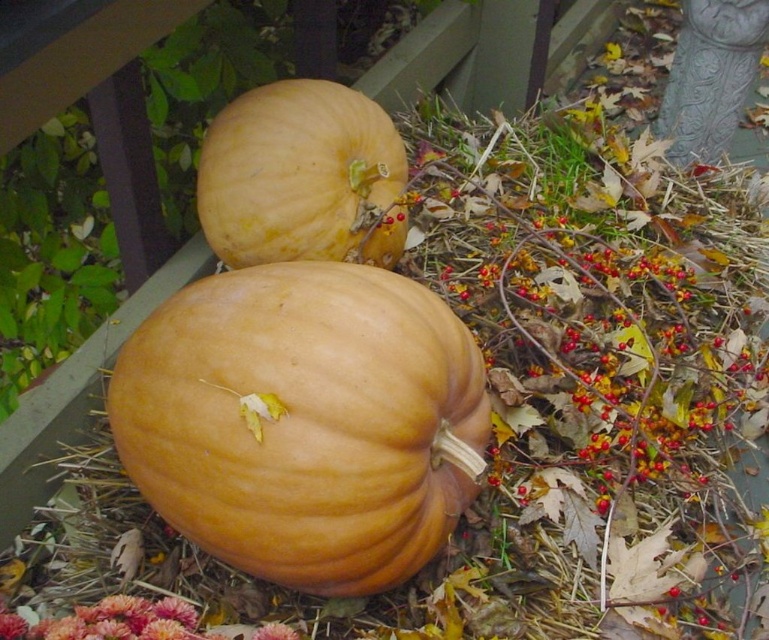
Question: Does matte orange pumpkin at center appear on the right side of matte orange pumpkin at upper center?

Choices:
 (A) no
 (B) yes

Answer: (B)

Question: Which of the following is the closest to the observer?

Choices:
 (A) matte orange pumpkin at center
 (B) matte orange pumpkin at upper center

Answer: (A)

Question: Which point appears closest to the camera in this image?

Choices:
 (A) (201, 496)
 (B) (378, 147)

Answer: (A)

Question: Observing the image, what is the correct spatial positioning of matte orange pumpkin at center in reference to matte orange pumpkin at upper center?

Choices:
 (A) above
 (B) below

Answer: (B)

Question: Does matte orange pumpkin at center have a smaller size compared to matte orange pumpkin at upper center?

Choices:
 (A) yes
 (B) no

Answer: (B)